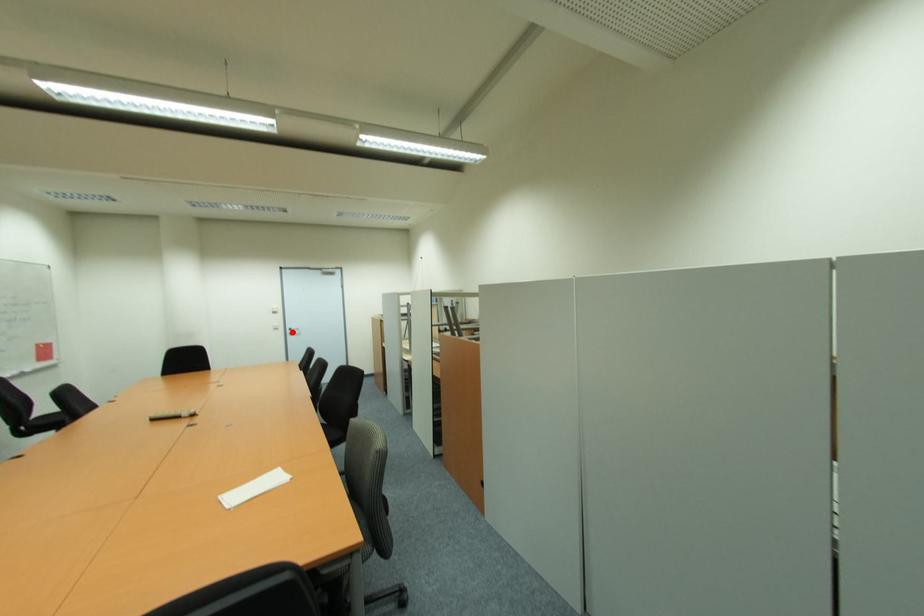
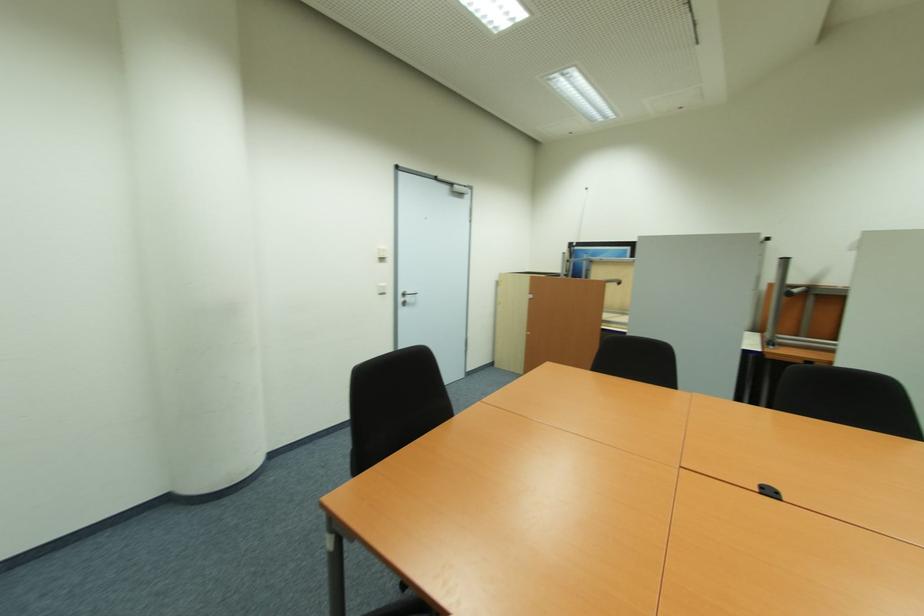
Question: I am providing you with two images of the same scene from different viewpoints. A red point is marked on the first image. At the location where the point appears in image 1, is it still visible in image 2?

Choices:
 (A) Yes
 (B) No

Answer: (A)